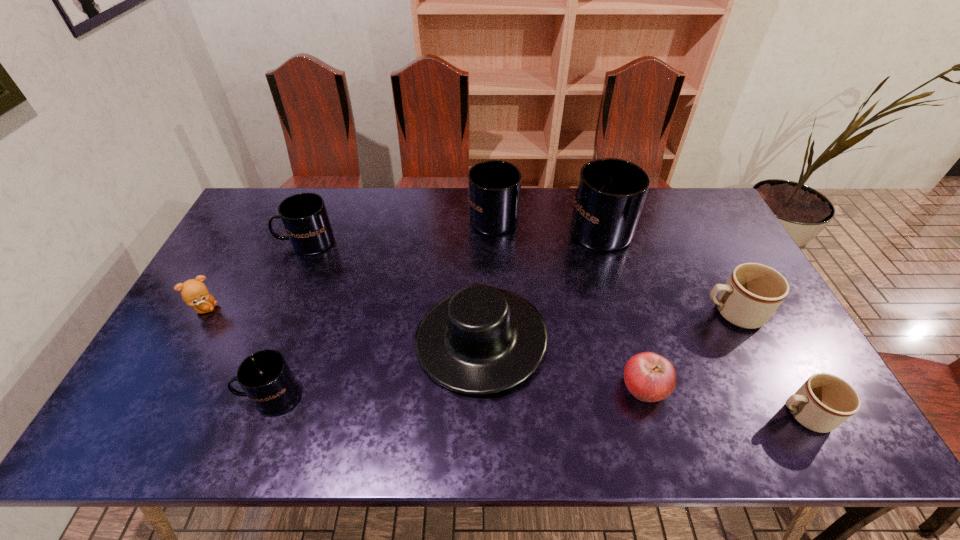
Locate an element on the screen. The image size is (960, 540). the smallest black mug is located at coordinates (265, 377).

Find the location of a particular element. apple is located at coordinates (649, 377).

Where is `the smaller brown mug`? The height and width of the screenshot is (540, 960). the smaller brown mug is located at coordinates (824, 401).

Find the location of `free region located 0.160m with the handle on the side of the second smallest black mug`. free region located 0.160m with the handle on the side of the second smallest black mug is located at coordinates (231, 242).

The width and height of the screenshot is (960, 540). In order to click on vacant space located on the back of the dress hat in this screenshot , I will do [x=481, y=246].

You are a GUI agent. You are given a task and a screenshot of the screen. Output one action in this format:
    pyautogui.click(x=<x>, y=<y>)
    Task: Click on the vacant area situated on the side of the third nearest mug with the handle
    
    Given the screenshot: What is the action you would take?
    pyautogui.click(x=671, y=313)

Identify the location of vacant space positioned on the side of the third nearest mug with the handle. (561, 313).

Where is `vacant area situated 0.370m on the side of the third nearest mug with the handle`? vacant area situated 0.370m on the side of the third nearest mug with the handle is located at coordinates point(568,313).

Where is `vacant space positioned on the face of the leftmost object`? Image resolution: width=960 pixels, height=540 pixels. vacant space positioned on the face of the leftmost object is located at coordinates (305, 309).

Where is `vacant area situated 0.070m with the handle on the side of the nearest black mug`? The width and height of the screenshot is (960, 540). vacant area situated 0.070m with the handle on the side of the nearest black mug is located at coordinates (213, 394).